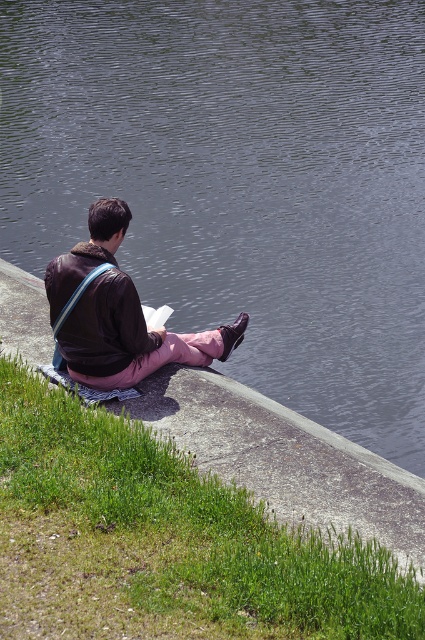
You are standing at the concrete ledge by the water and want to place a small item on the ground. There are two points marked as point 1 at coordinates (8, 429) and point 2 at (88, 264). Which point is closer to you where you can place the item without bending down too much?

Point 1 at coordinates (8, 429) is closer to the viewer than point 2 at (88, 264), so placing the item there would require less bending down.

You are planning to place a small picnic basket between the green grass at lower left and the matte brown jacket at center. Based on their sizes, which object can accommodate the basket more comfortably?

The green grass at lower left has a larger size compared to the matte brown jacket at center, so it can accommodate the picnic basket more comfortably.